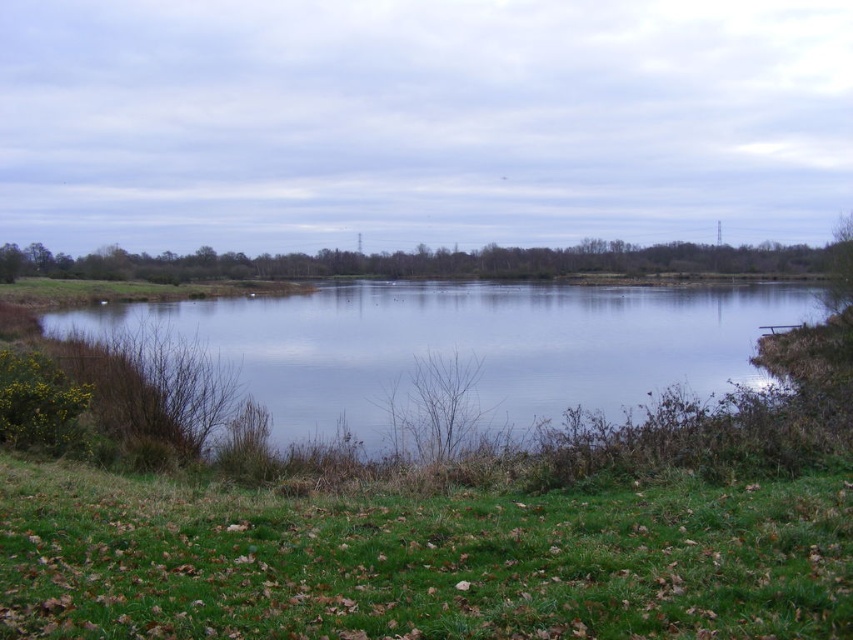
Question: Which point is farther from the camera taking this photo?

Choices:
 (A) (776, 616)
 (B) (521, 424)

Answer: (B)

Question: Does green grassy at lower left have a smaller size compared to transparent water at center?

Choices:
 (A) yes
 (B) no

Answer: (A)

Question: Considering the relative positions of green grassy at lower left and transparent water at center in the image provided, where is green grassy at lower left located with respect to transparent water at center?

Choices:
 (A) below
 (B) above

Answer: (A)

Question: Which point is farther to the camera?

Choices:
 (A) transparent water at center
 (B) green grassy at lower left

Answer: (A)

Question: Does green grassy at lower left have a smaller size compared to transparent water at center?

Choices:
 (A) no
 (B) yes

Answer: (B)